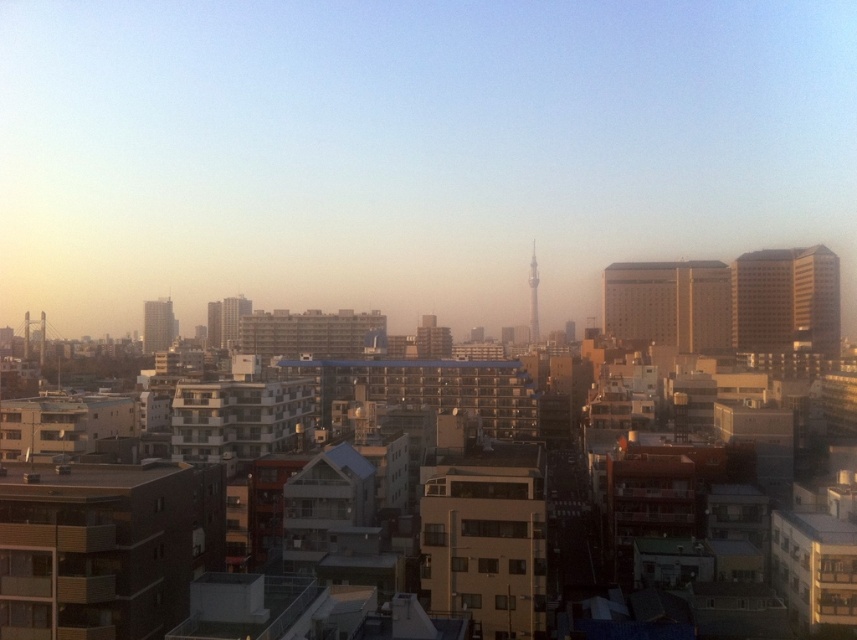
Question: Where is white glossy building at center located in relation to matte gray building at left in the image?

Choices:
 (A) below
 (B) above

Answer: (B)

Question: Which of the following is the farthest from the observer?

Choices:
 (A) matte gray building at left
 (B) white glossy building at center
 (C) beige concrete building at right

Answer: (A)

Question: Is beige concrete building at right smaller than white glossy building at center?

Choices:
 (A) yes
 (B) no

Answer: (A)

Question: Considering the relative positions of beige concrete building at right and brown textured building at center in the image provided, where is beige concrete building at right located with respect to brown textured building at center?

Choices:
 (A) left
 (B) right

Answer: (B)

Question: Which point is closer to the camera?

Choices:
 (A) (730, 300)
 (B) (229, 308)
 (C) (792, 291)
 (D) (166, 314)

Answer: (C)

Question: Considering the real-world distances, which object is closest to the white glossy building at center?

Choices:
 (A) smooth glass tower at center
 (B) matte gray building at left
 (C) brown textured building at center

Answer: (B)